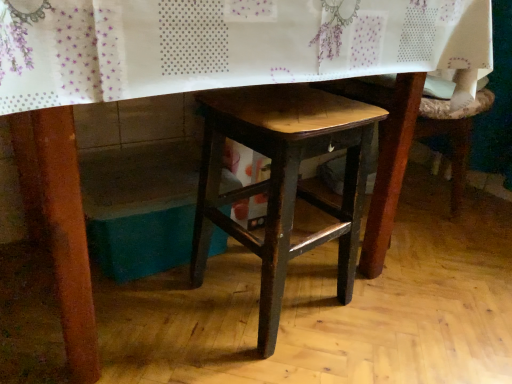
At what (x,y) coordinates should I click in order to perform the action: click on free point in front of wooden stool at center. Please return your answer as a coordinate pair (x, y). This screenshot has width=512, height=384. Looking at the image, I should click on (259, 360).